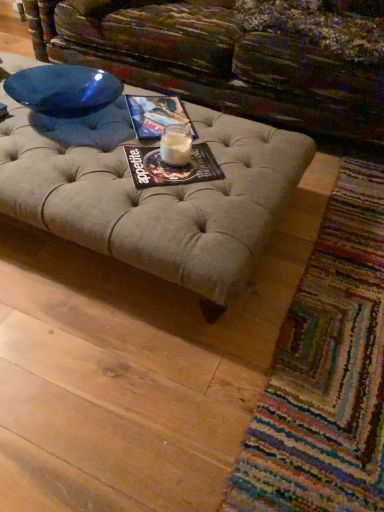
Question: Are white glass candle at center and matte paper magazine at center, the first magazine from the back, far apart?

Choices:
 (A) no
 (B) yes

Answer: (A)

Question: Is white glass candle at center placed right next to matte paper magazine at center, positioned as the 1th magazine in top-to-bottom order?

Choices:
 (A) yes
 (B) no

Answer: (B)

Question: Is white glass candle at center positioned beyond the bounds of matte paper magazine at center, the first magazine from the back?

Choices:
 (A) yes
 (B) no

Answer: (A)

Question: Considering the relative sizes of white glass candle at center and matte paper magazine at center, positioned as the 1th magazine in top-to-bottom order, in the image provided, is white glass candle at center shorter than matte paper magazine at center, positioned as the 1th magazine in top-to-bottom order,?

Choices:
 (A) yes
 (B) no

Answer: (B)

Question: Considering the relative sizes of white glass candle at center and matte paper magazine at center, positioned as the second magazine in front-to-back order, in the image provided, is white glass candle at center thinner than matte paper magazine at center, positioned as the second magazine in front-to-back order,?

Choices:
 (A) yes
 (B) no

Answer: (A)

Question: From the image's perspective, is matte paper magazine at center, the 2th magazine when ordered from top to bottom, located above or below matte paper magazine at center, positioned as the second magazine in front-to-back order?

Choices:
 (A) above
 (B) below

Answer: (B)

Question: Considering the positions of point (208, 156) and point (137, 122), is point (208, 156) closer or farther from the camera than point (137, 122)?

Choices:
 (A) farther
 (B) closer

Answer: (B)

Question: Relative to matte paper magazine at center, the first magazine from the back, is matte paper magazine at center, the 2th magazine when ordered from top to bottom, in front or behind?

Choices:
 (A) front
 (B) behind

Answer: (A)

Question: From their relative heights in the image, would you say matte paper magazine at center, arranged as the 2th magazine when viewed from the back, is taller or shorter than matte paper magazine at center, positioned as the 1th magazine in top-to-bottom order?

Choices:
 (A) short
 (B) tall

Answer: (A)

Question: Do you think matte paper magazine at center, the first magazine from the back, is within multicolored woven mat at lower right, or outside of it?

Choices:
 (A) inside
 (B) outside

Answer: (B)

Question: Is point (162, 129) closer or farther from the camera than point (354, 283)?

Choices:
 (A) farther
 (B) closer

Answer: (B)

Question: From a real-world perspective, is matte paper magazine at center, positioned as the 1th magazine in top-to-bottom order, above or below multicolored woven mat at lower right?

Choices:
 (A) above
 (B) below

Answer: (A)

Question: Looking at their shapes, would you say matte paper magazine at center, positioned as the 1th magazine in top-to-bottom order, is wider or thinner than multicolored woven mat at lower right?

Choices:
 (A) wide
 (B) thin

Answer: (B)

Question: Do you think matte paper magazine at center, the 1th magazine positioned from the front, is within white glass candle at center, or outside of it?

Choices:
 (A) inside
 (B) outside

Answer: (B)

Question: Does point (160, 181) appear closer or farther from the camera than point (177, 129)?

Choices:
 (A) farther
 (B) closer

Answer: (B)